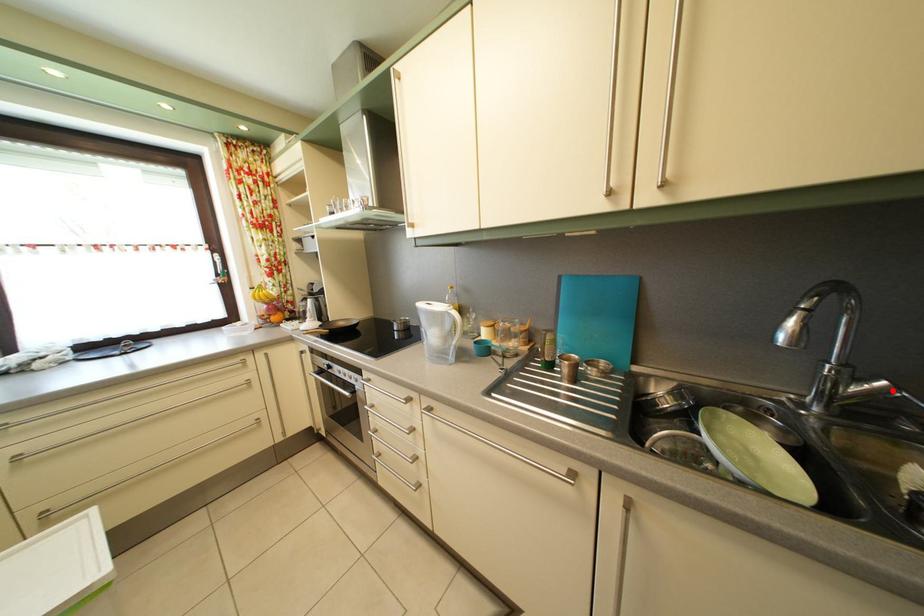
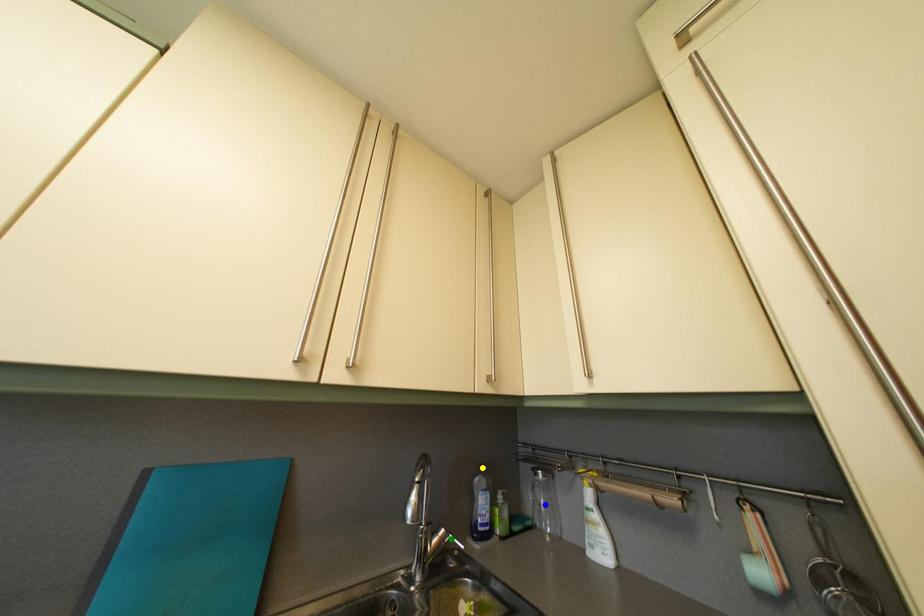
Question: I am providing you with two images of the same scene from different viewpoints. A red point is marked on the first image. You are given multiple points on the second image. Can you choose the point in image 2 that corresponds to the point in image 1?

Choices:
 (A) yellow point
 (B) blue point
 (C) green point

Answer: (C)